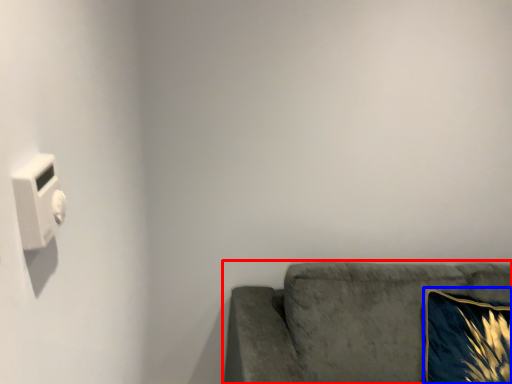
Question: Which object appears closest to the camera in this image, studio couch (highlighted by a red box) or throw pillow (highlighted by a blue box)?

Choices:
 (A) studio couch
 (B) throw pillow

Answer: (A)